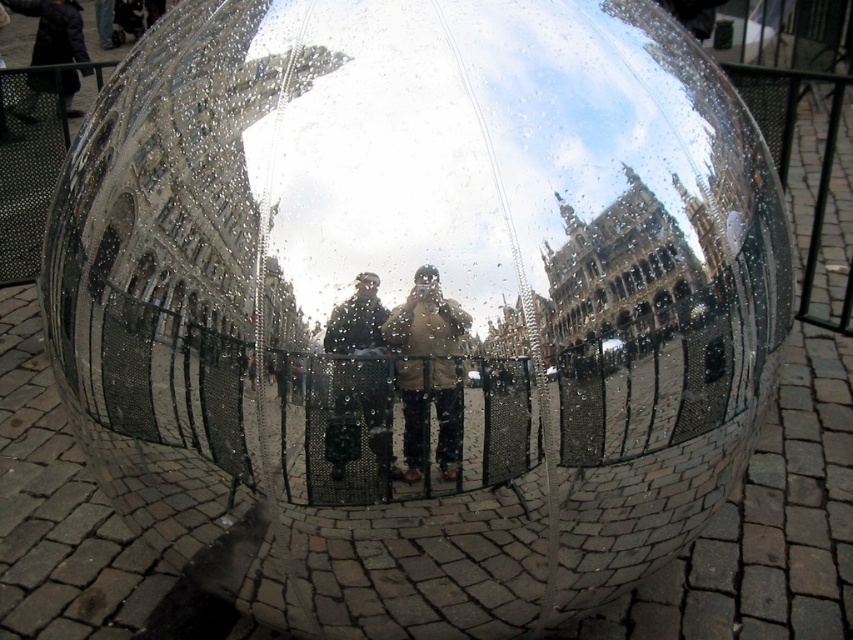
You are a fashion designer observing the reflective metallic sphere on the cobblestone pavement. You notice two jackets reflected in the sphere. Which jacket, the dark gray fabric jacket at center or the dark blue jacket at upper left, appears shorter in the reflection?

The dark gray fabric jacket at center appears shorter compared to the dark blue jacket at upper left in the reflection.

You are standing in front of the reflective metallic sphere and see the two jackets reflected in it. Which jacket, the dark gray fabric jacket at center or the dark blue jacket at upper left, appears higher in the reflection?

The dark blue jacket at upper left appears higher in the reflection because the dark gray fabric jacket at center is located below it.

You are a fashion designer observing the reflective metallic sphere on the cobblestone pavement. You notice two jackets reflected in the sphere. Which jacket, the brown leather jacket at center or the dark blue jacket at upper left, appears smaller in the reflection?

The brown leather jacket at center appears smaller in the reflection than the dark blue jacket at upper left because the brown leather jacket at center is smaller than dark blue jacket at upper left according to the description.